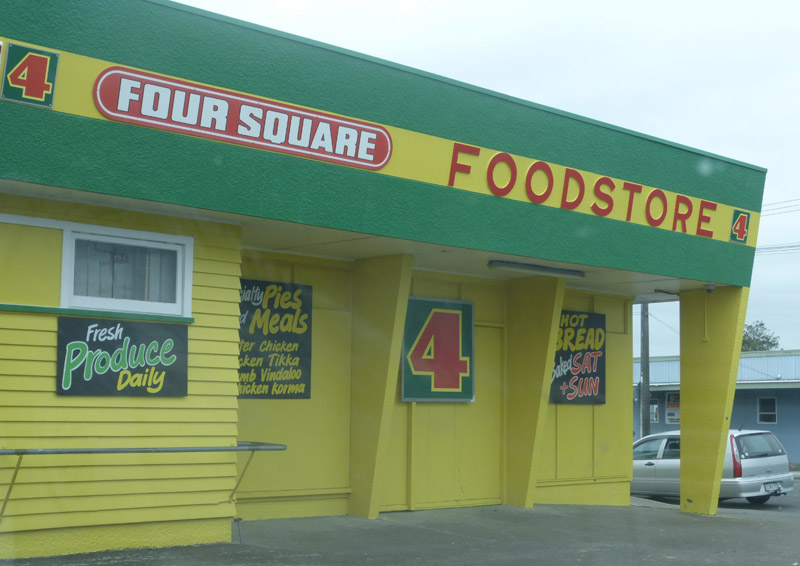
The width and height of the screenshot is (800, 566). Find the location of `handrail`. handrail is located at coordinates (270, 447).